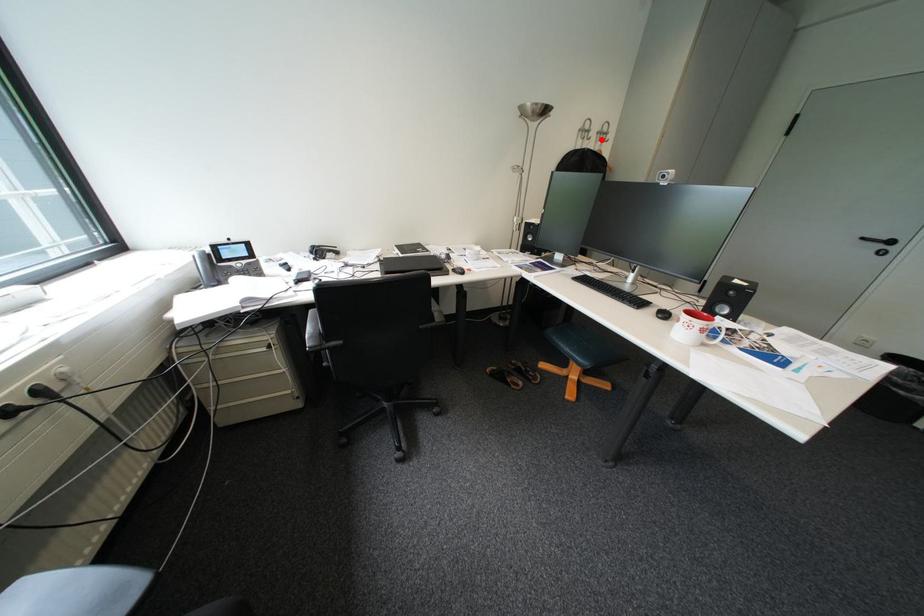
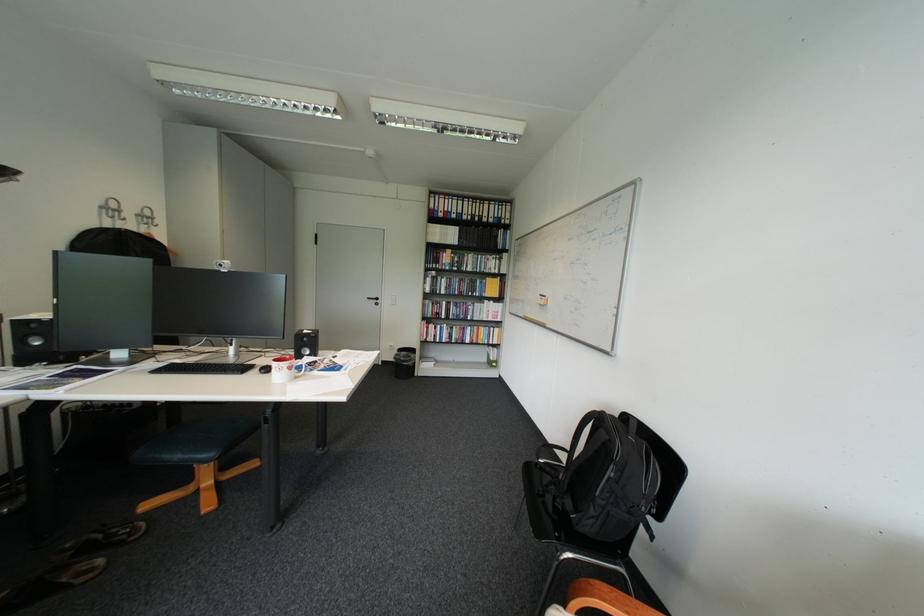
Find the pixel in the second image that matches the highlighted location in the first image.

(137, 220)